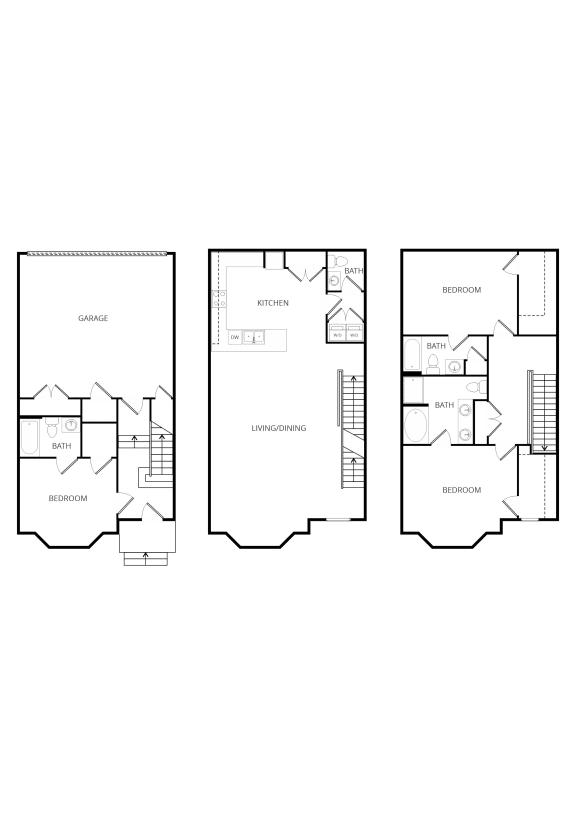
The image size is (576, 814). What are the coordinates of `stairs` in the screenshot? It's located at (144, 556), (132, 453), (166, 456), (350, 410), (353, 467), (543, 414).